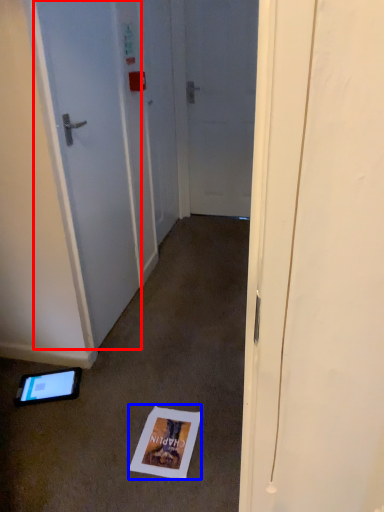
Question: Which point is further to the camera, door (highlighted by a red box) or postcard (highlighted by a blue box)?

Choices:
 (A) door
 (B) postcard

Answer: (B)